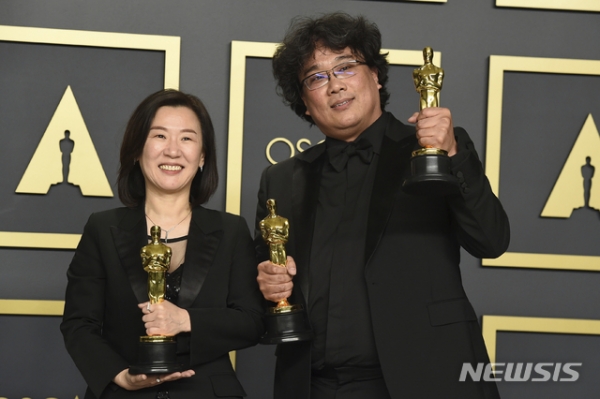
This screenshot has width=600, height=399. In order to click on base of trophy in this screenshot , I will do `click(166, 363)`, `click(277, 335)`, `click(429, 169)`.